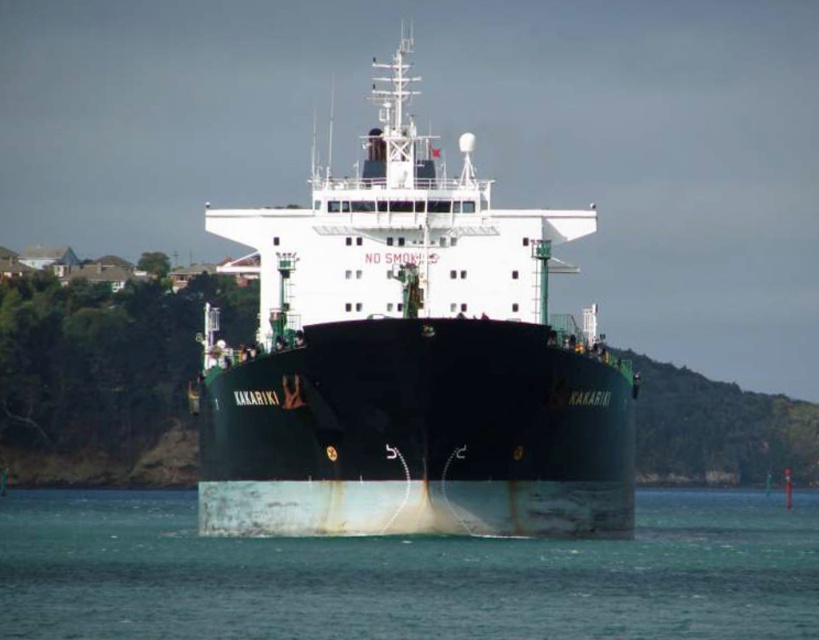
Can you confirm if green matte ship at center is positioned to the right of white matte water at center?

No, green matte ship at center is not to the right of white matte water at center.

Which is behind, point (326, 355) or point (801, 632)?

Point (326, 355)

This screenshot has height=640, width=819. In order to click on green matte ship at center in this screenshot , I will do `click(410, 362)`.